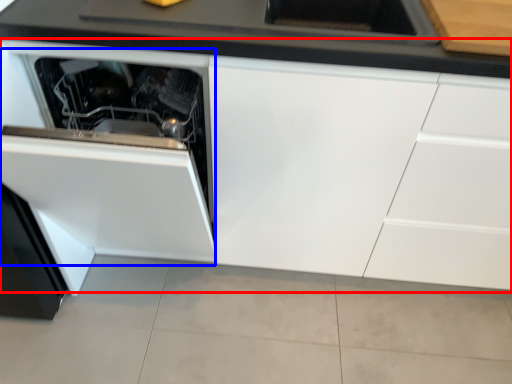
Question: Which point is closer to the camera, cabinetry (highlighted by a red box) or oven (highlighted by a blue box)?

Choices:
 (A) cabinetry
 (B) oven

Answer: (B)